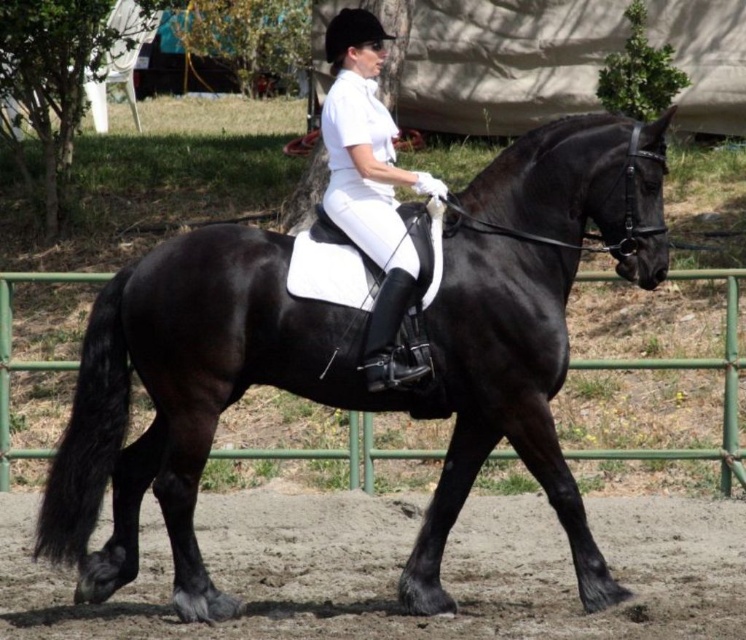
Does shiny black horse at center have a greater width compared to green metal fence at lower center?

Indeed, shiny black horse at center has a greater width compared to green metal fence at lower center.

Is point (131, 548) less distant than point (659, 458)?

Yes, point (131, 548) is in front of point (659, 458).

Where is `shiny black horse at center`? shiny black horse at center is located at coordinates (304, 396).

Locate an element on the screen. The width and height of the screenshot is (746, 640). sandy dirt at lower center is located at coordinates (398, 570).

Between sandy dirt at lower center and white matte riding pants at center, which one appears on the left side from the viewer's perspective?

From the viewer's perspective, white matte riding pants at center appears more on the left side.

At what (x,y) coordinates should I click in order to perform the action: click on sandy dirt at lower center. Please return your answer as a coordinate pair (x, y). This screenshot has height=640, width=746. Looking at the image, I should click on (398, 570).

Does shiny black horse at center have a smaller size compared to white matte riding pants at center?

Actually, shiny black horse at center might be larger than white matte riding pants at center.

This screenshot has height=640, width=746. In order to click on shiny black horse at center in this screenshot , I will do `click(304, 396)`.